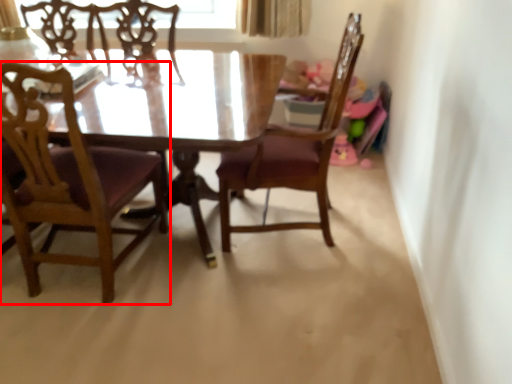
Question: From the image's perspective, what is the correct spatial positioning of chair (annotated by the red box) in reference to chair?

Choices:
 (A) above
 (B) below

Answer: (B)